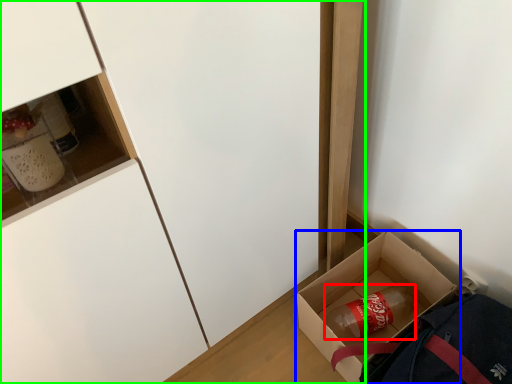
Question: Considering the real-world distances, which object is closest to beverage (highlighted by a red box)? box (highlighted by a blue box) or cabinetry (highlighted by a green box).

Choices:
 (A) box
 (B) cabinetry

Answer: (A)